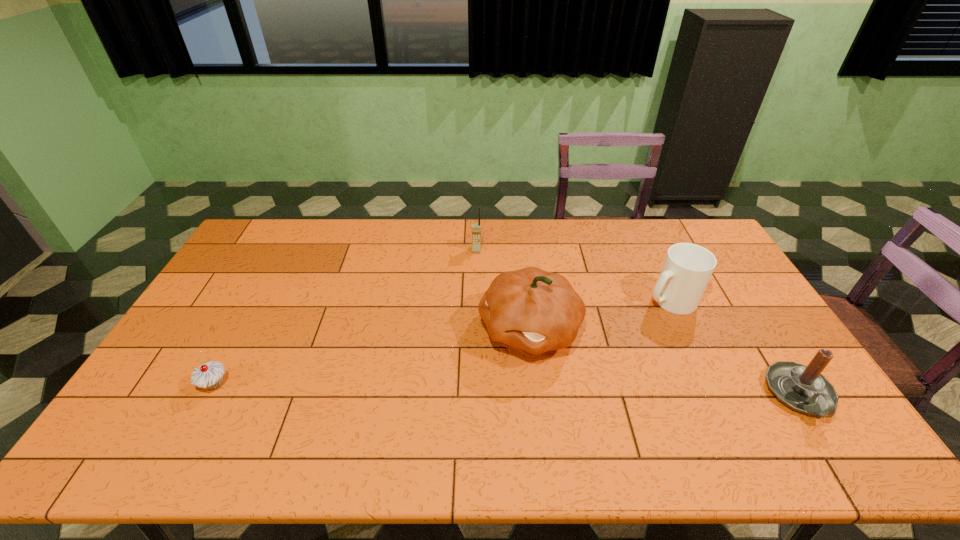
At what (x,y) coordinates should I click in order to perform the action: click on object that is at the right edge. Please return your answer as a coordinate pair (x, y). This screenshot has height=540, width=960. Looking at the image, I should click on (803, 388).

Locate an element on the screen. object that is at the near left corner is located at coordinates (210, 375).

Where is `object that is at the near right corner`? This screenshot has height=540, width=960. object that is at the near right corner is located at coordinates (803, 388).

This screenshot has height=540, width=960. In the image, there is a desktop. Find the location of `free space at the far edge`. free space at the far edge is located at coordinates (496, 224).

You are a GUI agent. You are given a task and a screenshot of the screen. Output one action in this format:
    pyautogui.click(x=<x>, y=<y>)
    Task: Click on the vacant area at the near edge
    
    Given the screenshot: What is the action you would take?
    pyautogui.click(x=564, y=390)

In the image, there is a desktop. Where is `free space at the left edge`? This screenshot has width=960, height=540. free space at the left edge is located at coordinates (259, 286).

In the image, there is a desktop. Identify the location of vacant space at the right edge. (767, 320).

Image resolution: width=960 pixels, height=540 pixels. In order to click on free space at the far left corner of the desktop in this screenshot , I will do `click(249, 250)`.

This screenshot has height=540, width=960. In the image, there is a desktop. Identify the location of vacant space at the near left corner. (197, 389).

Image resolution: width=960 pixels, height=540 pixels. Find the location of `free space at the far right corner`. free space at the far right corner is located at coordinates (665, 227).